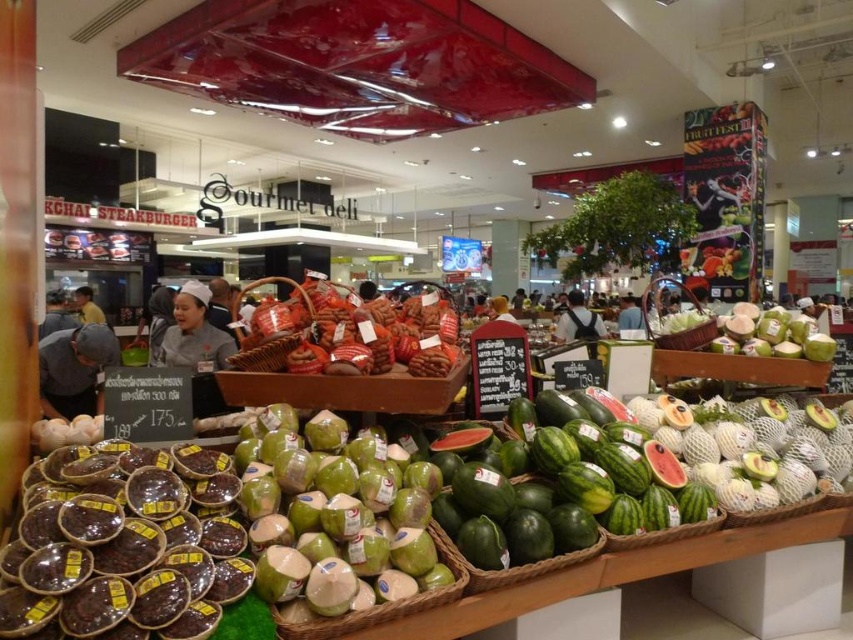
Is white uniform at center bigger than yellow shirt at left?

Yes.

Between white uniform at center and yellow shirt at left, which one has more height?

white uniform at center

Which is behind, point (204, 316) or point (97, 308)?

Point (97, 308)

Locate an element on the screen. The width and height of the screenshot is (853, 640). white uniform at center is located at coordinates click(194, 332).

The image size is (853, 640). What do you see at coordinates (351, 333) in the screenshot?
I see `brown textured bread at center` at bounding box center [351, 333].

Which is in front, point (357, 328) or point (88, 369)?

Positioned in front is point (357, 328).

What do you see at coordinates (351, 333) in the screenshot? The width and height of the screenshot is (853, 640). I see `brown textured bread at center` at bounding box center [351, 333].

Find the location of a particular element. brown textured bread at center is located at coordinates (351, 333).

Does green matte coconut at lower left have a larger size compared to brown textured bread at center?

Indeed, green matte coconut at lower left has a larger size compared to brown textured bread at center.

The height and width of the screenshot is (640, 853). In order to click on green matte coconut at lower left in this screenshot , I will do `click(335, 516)`.